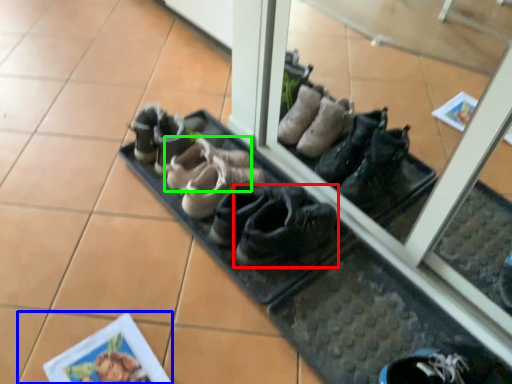
Question: Based on their relative distances, which object is nearer to footwear (highlighted by a red box)? Choose from tile (highlighted by a blue box) and footwear (highlighted by a green box).

Choices:
 (A) tile
 (B) footwear

Answer: (B)